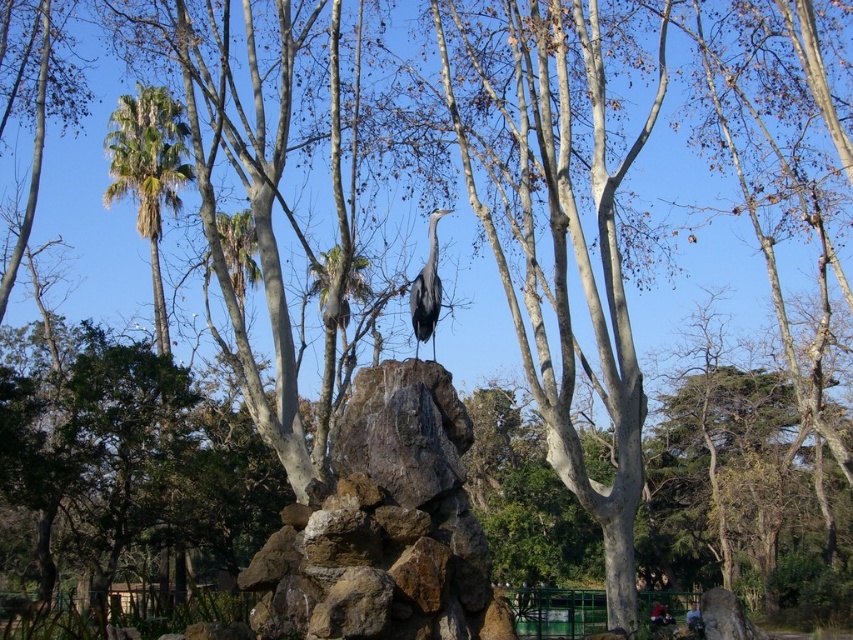
You are a photographer trying to capture the brown rough rock at center and the green leafy palm at left in your shot. Based on their positions, which object would appear larger in your photo?

The brown rough rock at center appears larger in the photo because it is closer to the viewer than the green leafy palm at left.

You are a birdwatcher observing the gray matte heron at center and the green leafy palm at left. Which object is larger in size?

The green leafy palm at left is bigger than the gray matte heron at center according to the description.

You are an ornithologist studying the positioning of birds in their natural habitats. You observe the brown rough rock at center in the image. Can you determine the exact 2D coordinates of this rock in the scene?

The exact 2D coordinates of the brown rough rock at center are located at point (386, 525).